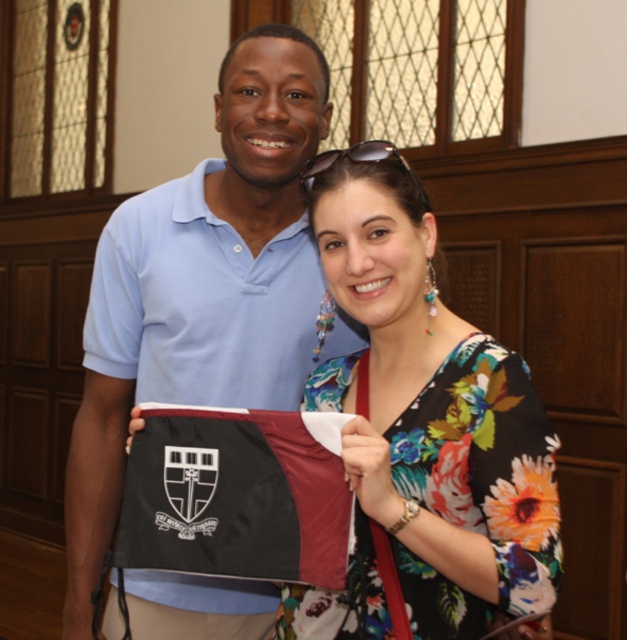
You are a photographer setting up for a group photo. You notice the light blue cotton polo shirt at center and the black fabric flag at center in the frame. Which object is covering the other one in the image?

The light blue cotton polo shirt at center is positioned over the black fabric flag at center, meaning it is covering the flag.

Based on the photo, you are a photographer setting up for a group photo. You have two subjects wearing the light blue cotton polo shirt at center and the floral fabric dress at center. You want to ensure both subjects are framed properly. Which clothing item is taller, requiring you to adjust the camera angle upwards to capture the full height?

The light blue cotton polo shirt at center is taller than the floral fabric dress at center, so you should adjust the camera angle upwards to capture the full height of the subject wearing the light blue cotton polo shirt at center.

You are a photographer trying to capture the light blue cotton polo shirt at center in the image. The camera is set to focus on the point at coordinates point (201,285). Will the light blue cotton polo shirt at center be in focus?

Yes, the light blue cotton polo shirt at center is located at point (201,285), so the camera will focus on it and it will be in focus.